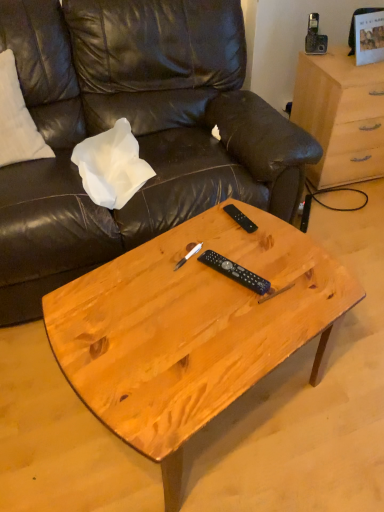
Question: Does black plastic remote at center, placed as the second remote when sorted from bottom to top, have a lesser height compared to black plastic remote at center, the 1th remote positioned from the bottom?

Choices:
 (A) no
 (B) yes

Answer: (B)

Question: Are black plastic remote at center, marked as the 1th remote in a top-to-bottom arrangement, and black plastic remote at center, the second remote in the back-to-front sequence, far apart?

Choices:
 (A) no
 (B) yes

Answer: (A)

Question: Does black plastic remote at center, arranged as the 1th remote when viewed from the back, have a smaller size compared to black plastic remote at center, the 1th remote positioned from the bottom?

Choices:
 (A) yes
 (B) no

Answer: (A)

Question: Is black plastic remote at center, arranged as the 1th remote when viewed from the back, looking in the opposite direction of black plastic remote at center, acting as the 2th remote starting from the top?

Choices:
 (A) yes
 (B) no

Answer: (B)

Question: Considering the relative sizes of black plastic remote at center, arranged as the 1th remote when viewed from the back, and black plastic remote at center, the 1th remote positioned from the bottom, in the image provided, is black plastic remote at center, arranged as the 1th remote when viewed from the back, bigger than black plastic remote at center, the 1th remote positioned from the bottom,?

Choices:
 (A) yes
 (B) no

Answer: (B)

Question: Looking at their shapes, would you say natural wood coffee table at center is wider or thinner than white paper at upper left?

Choices:
 (A) wide
 (B) thin

Answer: (A)

Question: Considering the positions of natural wood coffee table at center and white paper at upper left in the image, is natural wood coffee table at center taller or shorter than white paper at upper left?

Choices:
 (A) tall
 (B) short

Answer: (A)

Question: Does point (130, 292) appear closer or farther from the camera than point (100, 186)?

Choices:
 (A) farther
 (B) closer

Answer: (B)

Question: Would you say natural wood coffee table at center is to the left or to the right of white paper at upper left in the picture?

Choices:
 (A) right
 (B) left

Answer: (A)

Question: Is white paper at upper left bigger or smaller than natural wood coffee table at center?

Choices:
 (A) big
 (B) small

Answer: (B)

Question: Considering the positions of point (147, 172) and point (140, 353), is point (147, 172) closer or farther from the camera than point (140, 353)?

Choices:
 (A) closer
 (B) farther

Answer: (B)

Question: Would you say white paper at upper left is inside or outside natural wood coffee table at center?

Choices:
 (A) outside
 (B) inside

Answer: (A)

Question: Considering the relative positions of white paper at upper left and natural wood coffee table at center in the image provided, is white paper at upper left to the left or to the right of natural wood coffee table at center?

Choices:
 (A) left
 (B) right

Answer: (A)

Question: Is leather couch at center bigger or smaller than white paper at upper left?

Choices:
 (A) big
 (B) small

Answer: (A)

Question: Considering the positions of point (125, 8) and point (132, 139), is point (125, 8) closer or farther from the camera than point (132, 139)?

Choices:
 (A) closer
 (B) farther

Answer: (A)